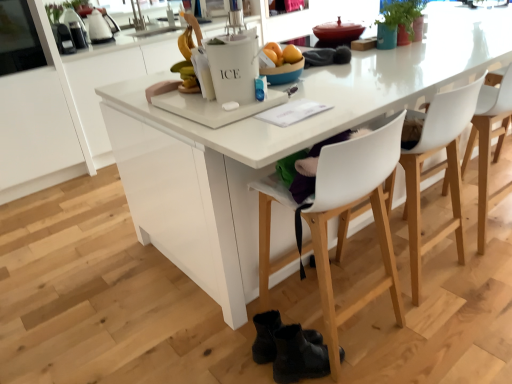
Question: Based on their sizes in the image, would you say white plastic chair at right, which is the first chair from right to left, is bigger or smaller than green matte plant at upper right?

Choices:
 (A) big
 (B) small

Answer: (A)

Question: From the image's perspective, is white plastic chair at right, acting as the third chair starting from the left, positioned above or below green matte plant at upper right?

Choices:
 (A) below
 (B) above

Answer: (A)

Question: Estimate the real-world distances between objects in this image. Which object is farther from the white plastic chair at center, which is counted as the 3th chair, starting from the right?

Choices:
 (A) black leather boots at lower center, marked as the 2th footwear in a back-to-front arrangement
 (B) green matte plant at upper right
 (C) white plastic ice bucket at center
 (D) black leather boots at lower center, acting as the first footwear starting from the back
 (E) transparent glass window at upper left

Answer: (E)

Question: Which object is positioned farthest from the white plastic chair at right, which is the first chair from right to left?

Choices:
 (A) white plastic chair at center, which is the 1th chair in left-to-right order
 (B) transparent glass window at upper left
 (C) white plastic ice bucket at center
 (D) black leather boots at lower center, marked as the 2th footwear in a back-to-front arrangement
 (E) white plastic chair at center, the 2th chair viewed from the left

Answer: (B)